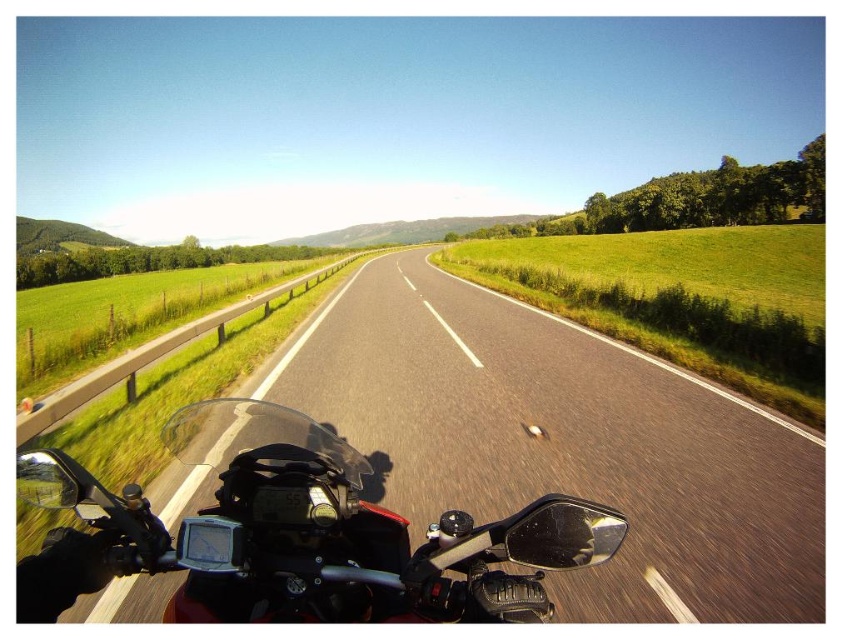
You are a motorcyclist planning to ride your shiny black motorcycle at center on the asphalt road at center. Considering the size difference between the two, will you have enough space to maneuver safely on the road?

The asphalt road at center is larger in size than the shiny black motorcycle at center, so there should be sufficient space to maneuver safely on the asphalt road at center.

You are a motorcyclist riding along a two lane road. You see the point marked at coordinates (563, 442). Where is this point located in relation to the motorcycle?

The point marked at coordinates (563, 442) is located on the asphalt road at center, which is directly in front of the motorcycle.

You are a motorcyclist riding on the asphalt road at center. Your motorcycle has a wheelbase of 1.5 meters. Can you safely make a U turn on the road without crossing the lane markings?

The distance between the asphalt road at center and the viewer is 2.65 meters. Since the motorcycle has a wheelbase of 1.5 meters, which is shorter than the available space, you can safely make a U turn on the asphalt road at center without crossing the lane markings.